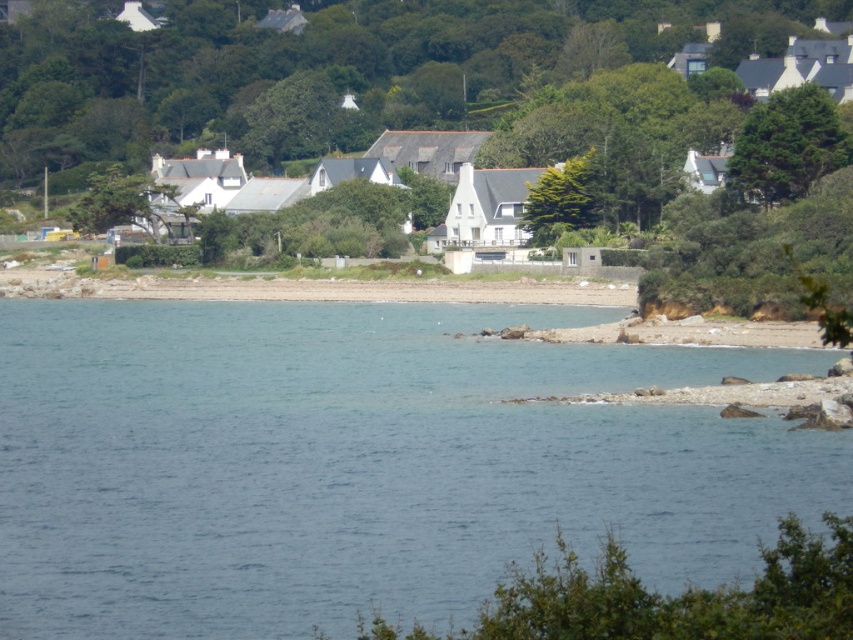
You are standing at the shoreline in the coastal scene. There is a point marked at coordinates point (57, 582). Can you walk to that point from your current position without getting wet?

The point (57, 582) is 175.51 feet away from the viewer. Since you are at the shoreline, which is the edge where land meets the water, you can walk to the point as it is on the land side beyond the water edge.